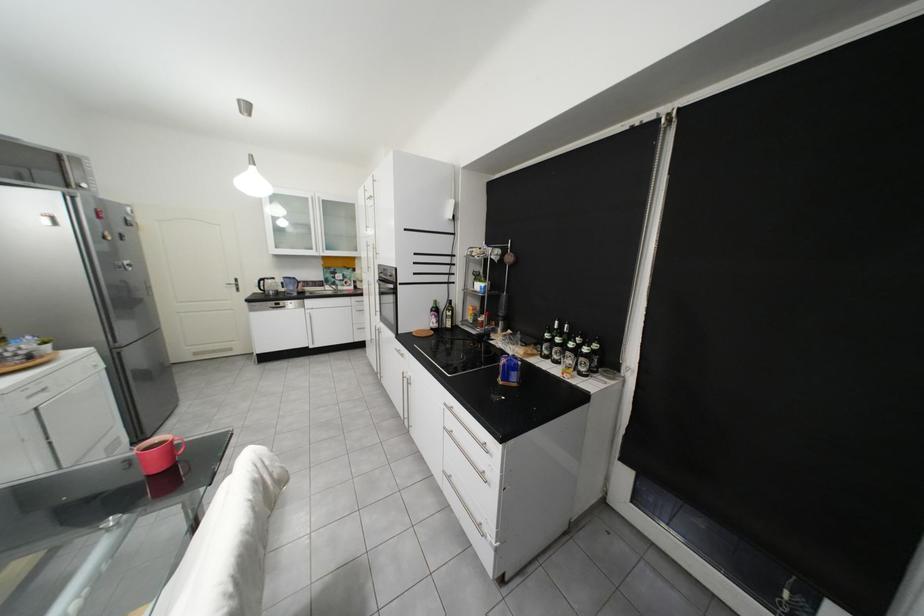
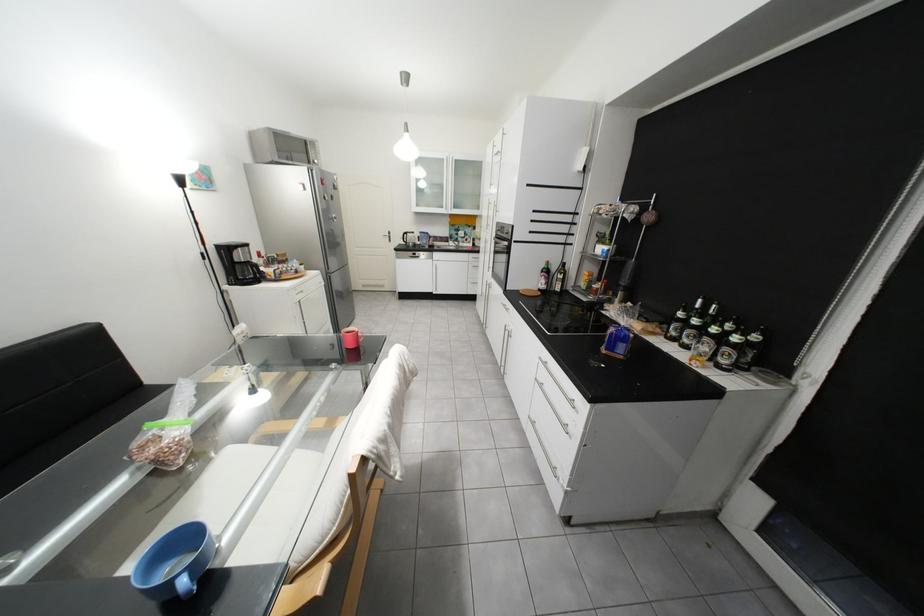
The point at (x=137, y=440) is marked in the first image. Where is the corresponding point in the second image?

(343, 331)